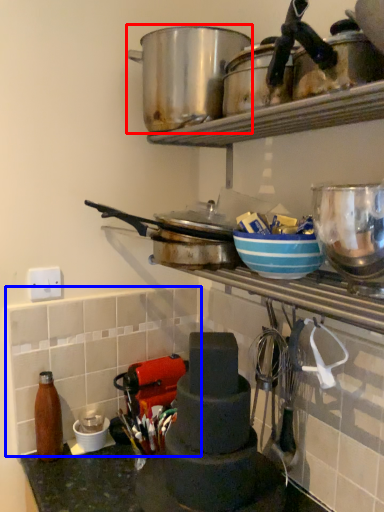
Question: Which of the following is the closest to the observer, crock pot (highlighted by a red box) or tile (highlighted by a blue box)?

Choices:
 (A) crock pot
 (B) tile

Answer: (A)